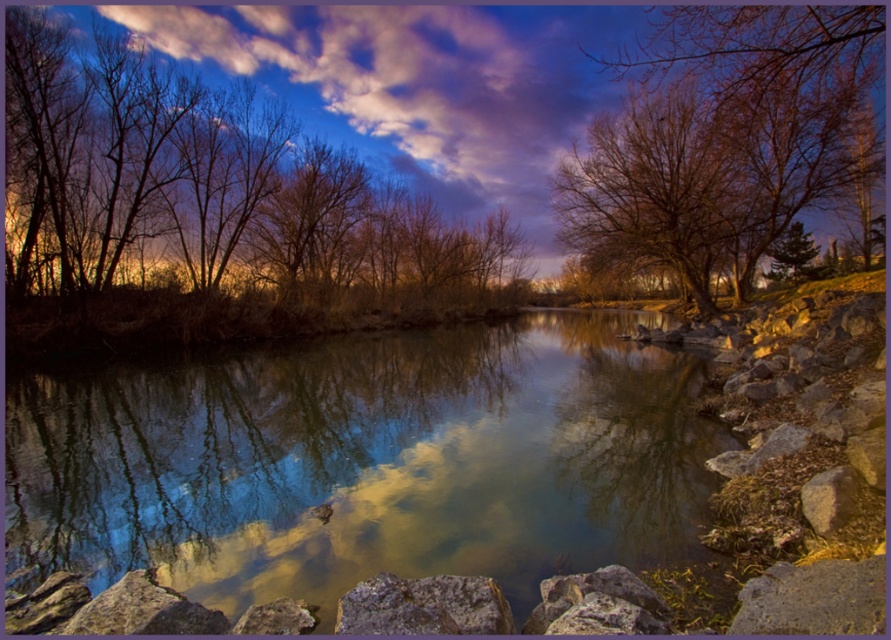
Can you confirm if clear water at center is positioned to the left of bare branches at upper right?

Correct, you'll find clear water at center to the left of bare branches at upper right.

Does clear water at center come in front of bare branches at upper right?

Yes, clear water at center is in front of bare branches at upper right.

At what (x,y) coordinates should I click in order to perform the action: click on clear water at center. Please return your answer as a coordinate pair (x, y). Looking at the image, I should click on (365, 461).

Find the location of a particular element. The image size is (891, 640). clear water at center is located at coordinates (365, 461).

Is clear water at center thinner than gray matte rock at lower right?

No.

Is point (185, 518) closer to camera compared to point (845, 509)?

No, (185, 518) is further to viewer.

At what (x,y) coordinates should I click in order to perform the action: click on clear water at center. Please return your answer as a coordinate pair (x, y). Looking at the image, I should click on (365, 461).

Locate an element on the screen. The height and width of the screenshot is (640, 891). clear water at center is located at coordinates (365, 461).

Can you confirm if clear water at center is bigger than brown/dry wood trees at upper left?

Incorrect, clear water at center is not larger than brown/dry wood trees at upper left.

Which is in front, point (571, 468) or point (186, 248)?

Point (571, 468) is more forward.

At what (x,y) coordinates should I click in order to perform the action: click on clear water at center. Please return your answer as a coordinate pair (x, y). The image size is (891, 640). Looking at the image, I should click on 365,461.